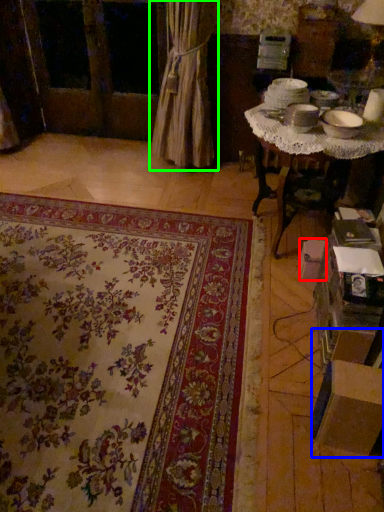
Question: Which object is positioned farthest from cardboard box (highlighted by a red box)? Select from cardboard box (highlighted by a blue box) and curtain (highlighted by a green box).

Choices:
 (A) cardboard box
 (B) curtain

Answer: (B)